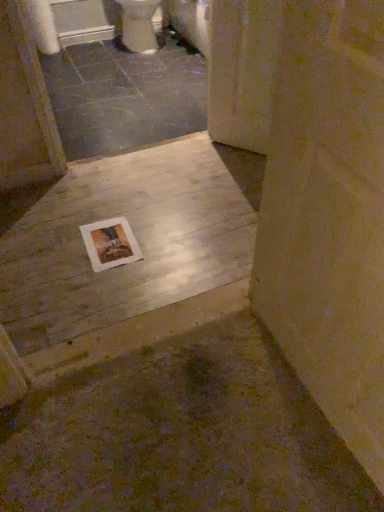
The width and height of the screenshot is (384, 512). I want to click on smooth gray concrete at center, which appears as the 1th concrete when viewed from the back, so click(125, 95).

What do you see at coordinates (42, 26) in the screenshot? I see `white paper at upper left` at bounding box center [42, 26].

This screenshot has height=512, width=384. Describe the element at coordinates (135, 236) in the screenshot. I see `wooden floor at center, which is the 2th concrete in back-to-front order` at that location.

What is the approximate width of white paper at center?

The width of white paper at center is 30.42 centimeters.

Identify the location of smooth gray concrete at center, which is the 2th concrete in bottom-to-top order. The width and height of the screenshot is (384, 512). (125, 95).

Is wooden screen door at upper right behind wooden floor at center, which is the 2th concrete in back-to-front order?

Yes, wooden screen door at upper right is further from the camera.

Considering the sizes of objects wooden screen door at upper right and wooden floor at center, the 1th concrete from the bottom, in the image provided, who is wider, wooden screen door at upper right or wooden floor at center, the 1th concrete from the bottom,?

Wider between the two is wooden floor at center, the 1th concrete from the bottom.

Considering the sizes of wooden screen door at upper right and wooden floor at center, the 2th concrete viewed from the top, in the image, is wooden screen door at upper right taller or shorter than wooden floor at center, the 2th concrete viewed from the top,?

Considering their sizes, wooden screen door at upper right has more height than wooden floor at center, the 2th concrete viewed from the top.

Between white paper at upper left and white glossy toilet at upper center, which one has larger size?

A: white glossy toilet at upper center.

From a real-world perspective, is white paper at upper left physically located above or below white glossy toilet at upper center?

From a real-world perspective, white paper at upper left is physically above white glossy toilet at upper center.

Based on their positions, is white paper at upper left located to the left or right of white glossy toilet at upper center?

Clearly, white paper at upper left is on the left of white glossy toilet at upper center in the image.

From the image's perspective, which object appears higher, white paper at upper left or white glossy toilet at upper center?

white glossy toilet at upper center appears higher in the image.

Looking at this image, considering the relative positions of white glossy toilet at upper center and white paper at center in the image provided, is white glossy toilet at upper center in front of white paper at center?

No, white glossy toilet at upper center is further to the viewer.

Between white glossy toilet at upper center and white paper at center, which one has smaller width?

Thinner between the two is white paper at center.

From a real-world perspective, between white glossy toilet at upper center and white paper at center, who is vertically higher?

In real-world perspective, white glossy toilet at upper center is above.

Considering the relative sizes of smooth gray concrete at center, the 1th concrete when ordered from top to bottom, and wooden screen door at upper right in the image provided, is smooth gray concrete at center, the 1th concrete when ordered from top to bottom, shorter than wooden screen door at upper right?

Correct, smooth gray concrete at center, the 1th concrete when ordered from top to bottom, is not as tall as wooden screen door at upper right.

Where is `the 1st concrete below the wooden screen door at upper right (from a real-world perspective)`? The image size is (384, 512). the 1st concrete below the wooden screen door at upper right (from a real-world perspective) is located at coordinates (125, 95).

Which object is closer to the camera, wooden screen door at upper right or white paper at upper left?

wooden screen door at upper right is in front.

Is wooden screen door at upper right oriented towards white paper at upper left?

No, wooden screen door at upper right is not oriented towards white paper at upper left.

The width and height of the screenshot is (384, 512). In the image, there is a wooden screen door at upper right. In order to click on toilet paper above it (from the image's perspective) in this screenshot , I will do `click(42, 26)`.

Considering the sizes of objects wooden screen door at upper right and white paper at upper left in the image provided, who is wider, wooden screen door at upper right or white paper at upper left?

white paper at upper left.

Based on the photo, based on their sizes in the image, would you say wooden floor at center, which is the 2th concrete in back-to-front order, is bigger or smaller than white paper at upper left?

In the image, wooden floor at center, which is the 2th concrete in back-to-front order, appears to be smaller than white paper at upper left.

Could you measure the distance between wooden floor at center, the 1th concrete from the bottom, and white paper at upper left?

wooden floor at center, the 1th concrete from the bottom, is 6.76 feet from white paper at upper left.

Considering the sizes of wooden floor at center, which is the 2th concrete in back-to-front order, and white paper at upper left in the image, is wooden floor at center, which is the 2th concrete in back-to-front order, wider or thinner than white paper at upper left?

Clearly, wooden floor at center, which is the 2th concrete in back-to-front order, has more width compared to white paper at upper left.

Does wooden floor at center, the 1th concrete from the bottom, lie behind white paper at upper left?

No, wooden floor at center, the 1th concrete from the bottom, is closer to the camera.

Is point (103, 237) more distant than point (127, 28)?

No, (103, 237) is closer to viewer.

Based on the photo, from the image's perspective, which one is positioned lower, white paper at center or white glossy toilet at upper center?

white paper at center, from the image's perspective.

From the picture: Considering the sizes of objects white paper at center and white glossy toilet at upper center in the image provided, who is shorter, white paper at center or white glossy toilet at upper center?

white paper at center.

Is white paper at center facing away from white glossy toilet at upper center?

→ No, white paper at center's orientation is not away from white glossy toilet at upper center.

Identify the location of concrete below the wooden screen door at upper right (from the image's perspective). (135, 236).

You are a GUI agent. You are given a task and a screenshot of the screen. Output one action in this format:
    pyautogui.click(x=<x>, y=<y>)
    Task: Click on the toilet paper positioned vertically above the white glossy toilet at upper center (from a real-world perspective)
    
    Given the screenshot: What is the action you would take?
    pyautogui.click(x=42, y=26)

From the image, which object appears to be nearer to white paper at upper left, white paper at center or wooden screen door at upper right?

Based on the image, wooden screen door at upper right appears to be nearer to white paper at upper left.

Based on their spatial positions, is white paper at center or smooth gray concrete at center, which appears as the 1th concrete when viewed from the back, further from white paper at upper left?

white paper at center is positioned further to the anchor white paper at upper left.

Which object lies nearer to the anchor point wooden floor at center, the 1th concrete from the bottom, white glossy toilet at upper center or white paper at center?

white paper at center.

Which object lies further to the anchor point wooden floor at center, which is the 2th concrete in back-to-front order, wooden screen door at upper right or white paper at upper left?

Among the two, white paper at upper left is located further to wooden floor at center, which is the 2th concrete in back-to-front order.

Considering their positions, is wooden floor at center, which is the 1th concrete in front-to-back order, positioned further to wooden screen door at upper right than white paper at upper left?

white paper at upper left.

When comparing their distances from wooden screen door at upper right, does white paper at upper left or white glossy toilet at upper center seem further?

white paper at upper left is further to wooden screen door at upper right.

Consider the image. When comparing their distances from smooth gray concrete at center, which is the 2th concrete in bottom-to-top order, does white glossy toilet at upper center or white paper at upper left seem closer?

white glossy toilet at upper center.

When comparing their distances from wooden floor at center, which is the 2th concrete in back-to-front order, does white paper at upper left or wooden screen door at upper right seem further?

Among the two, white paper at upper left is located further to wooden floor at center, which is the 2th concrete in back-to-front order.

Where is `concrete between wooden screen door at upper right and white glossy toilet at upper center in the front-back direction`? Image resolution: width=384 pixels, height=512 pixels. concrete between wooden screen door at upper right and white glossy toilet at upper center in the front-back direction is located at coordinates (125, 95).

I want to click on screen door that lies between white glossy toilet at upper center and white paper at center from top to bottom, so click(x=242, y=71).

At what (x,y) coordinates should I click in order to perform the action: click on toilet paper between wooden screen door at upper right and white glossy toilet at upper center in the front-back direction. Please return your answer as a coordinate pair (x, y). The width and height of the screenshot is (384, 512). Looking at the image, I should click on (42, 26).

This screenshot has height=512, width=384. Find the location of `concrete between white glossy toilet at upper center and wooden floor at center, which is the 2th concrete in back-to-front order, in the vertical direction`. concrete between white glossy toilet at upper center and wooden floor at center, which is the 2th concrete in back-to-front order, in the vertical direction is located at coordinates (125, 95).